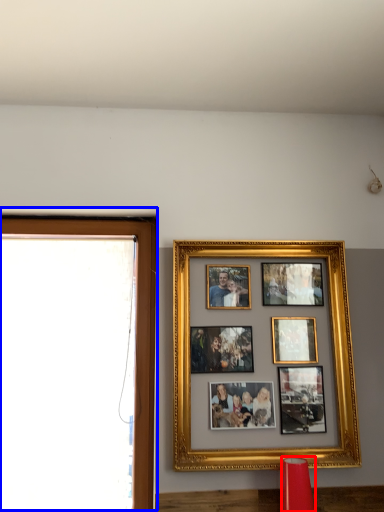
Question: Which of the following is the farthest to the observer, lamp (highlighted by a red box) or window frame (highlighted by a blue box)?

Choices:
 (A) lamp
 (B) window frame

Answer: (B)